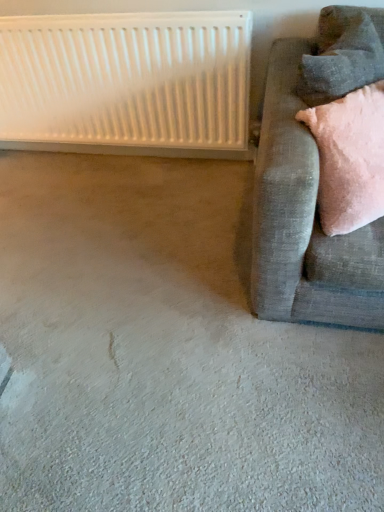
Question: Considering the relative positions of white plastic radiator at upper left and velvet grey couch at right in the image provided, is white plastic radiator at upper left to the left or to the right of velvet grey couch at right?

Choices:
 (A) left
 (B) right

Answer: (A)

Question: Is white plastic radiator at upper left wider or thinner than velvet grey couch at right?

Choices:
 (A) wide
 (B) thin

Answer: (B)

Question: Estimate the real-world distances between objects in this image. Which object is farther from the white plastic radiator at upper left?

Choices:
 (A) velvet grey couch at right
 (B) velvet gray pillow at upper right

Answer: (B)

Question: Estimate the real-world distances between objects in this image. Which object is closer to the white plastic radiator at upper left?

Choices:
 (A) velvet grey couch at right
 (B) velvet gray pillow at upper right

Answer: (A)